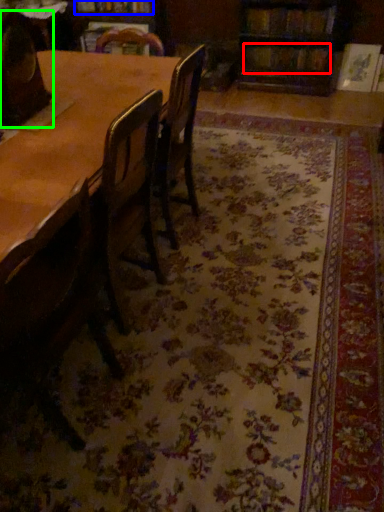
Question: Which object is the farthest from book (highlighted by a red box)? Choose among these: book (highlighted by a blue box) or chair (highlighted by a green box).

Choices:
 (A) book
 (B) chair

Answer: (B)